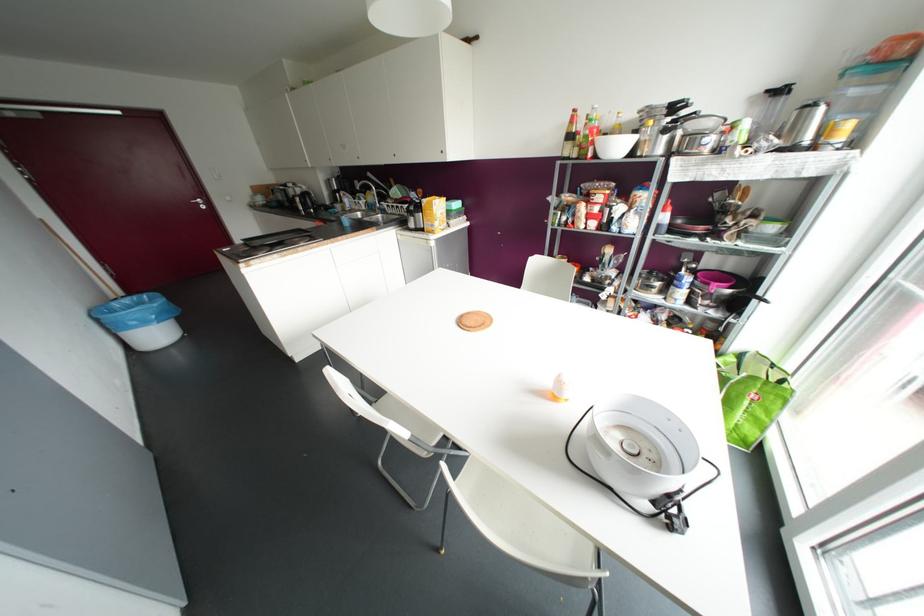
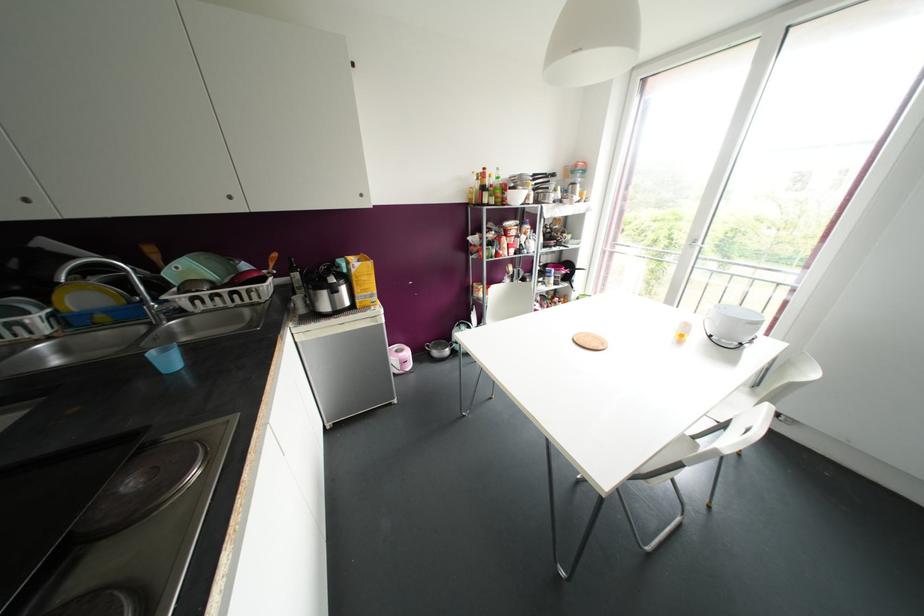
Where in the second image is the point corresponding to (x=821, y=108) from the first image?

(578, 185)